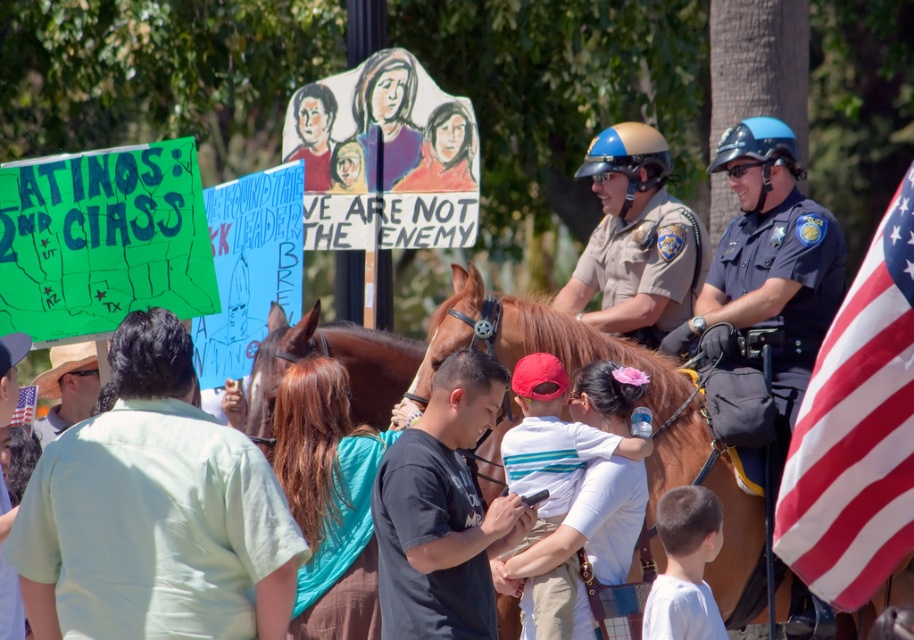
You are a photographer trying to capture the mounted police officers in the background. You notice a specific point in the image at coordinates (538, 340). What object is located at this point that might obstruct your view of the mounted police officers?

The brown leather horse at center is located at point (538, 340), which could obstruct the view of the mounted police officers in the background.

You are a journalist at the protest scene. You need to describe the relative sizes of the blue uniformed officer at right and the shiny blue helmet at center in your report. Which one appears larger?

The shiny blue helmet at center appears larger than the blue uniformed officer at right because the blue uniformed officer at right is smaller than the shiny blue helmet at center.

You are a participant in the protest and want to move from the location of point [740,497] to the location of point [661,524]. Considering the spatial relationship between these two points, which direction should you move to reach your destination?

Point [740,497] is behind point [661,524]. To move from point [740,497] to point [661,524], you should move forward since the destination is in front of your current position.